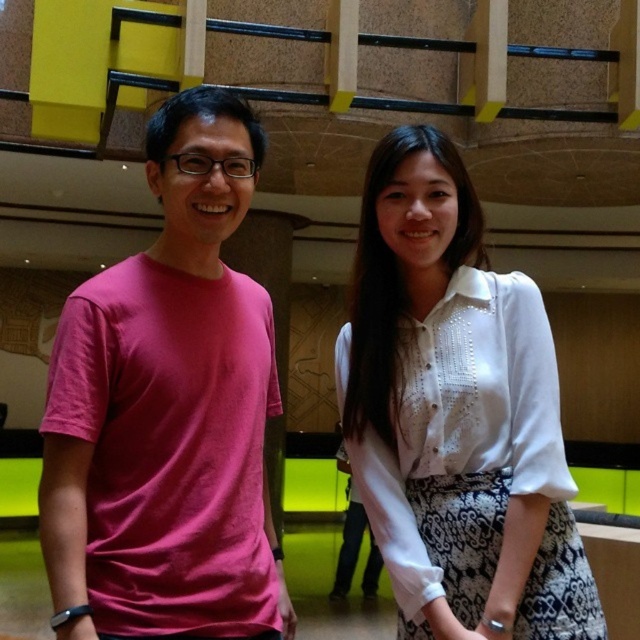
You are a delivery person carrying a box that requires a 1.2 meter clearance to pass through a narrow hallway. You see two people standing at point (128,532). Can you safely navigate between them without hitting the box?

The two people at point (128,532) are 1.33 meters apart, which is wider than the required 1.2 meter clearance. Therefore, you can safely navigate between them without hitting the box.